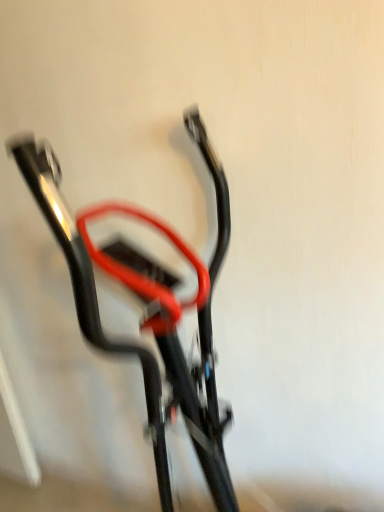
Find the location of `matte black bicycle handlebars at center`. matte black bicycle handlebars at center is located at coordinates [x=147, y=308].

Describe the element at coordinates (147, 308) in the screenshot. I see `matte black bicycle handlebars at center` at that location.

The height and width of the screenshot is (512, 384). I want to click on matte black bicycle handlebars at center, so click(147, 308).